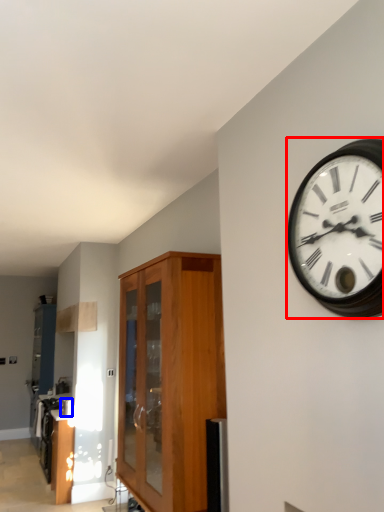
Question: Which point is closer to the camera, wall clock (highlighted by a red box) or appliance (highlighted by a blue box)?

Choices:
 (A) wall clock
 (B) appliance

Answer: (A)